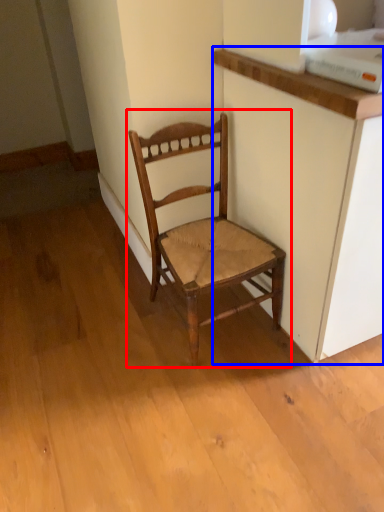
Question: Among these objects, which one is nearest to the camera, chair (highlighted by a red box) or cabinetry (highlighted by a blue box)?

Choices:
 (A) chair
 (B) cabinetry

Answer: (B)